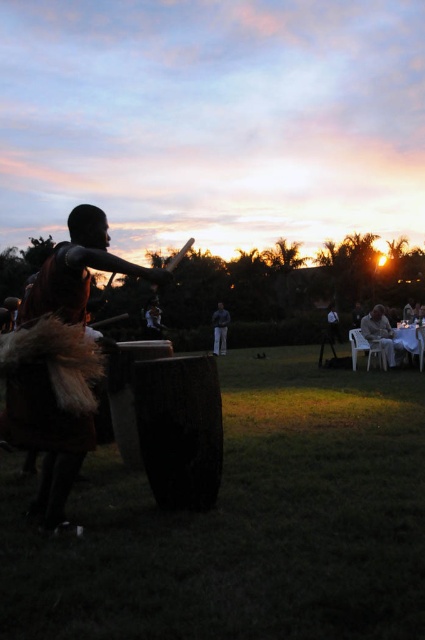
Is brown fur vest at left below white plastic chair at right?

No, brown fur vest at left is not below white plastic chair at right.

Does point (53, 456) come closer to viewer compared to point (374, 307)?

Yes, it is.

Identify the location of brown fur vest at left. The image size is (425, 640). (48, 442).

Does white plastic chair at right have a smaller size compared to dark gray fabric pants at center?

No, white plastic chair at right is not smaller than dark gray fabric pants at center.

Who is lower down, white plastic chair at right or dark gray fabric pants at center?

dark gray fabric pants at center

What do you see at coordinates (382, 333) in the screenshot? I see `white plastic chair at right` at bounding box center [382, 333].

You are a GUI agent. You are given a task and a screenshot of the screen. Output one action in this format:
    pyautogui.click(x=<x>, y=<y>)
    Task: Click on the white plastic chair at right
    
    Given the screenshot: What is the action you would take?
    pyautogui.click(x=382, y=333)

Is brown fur vest at left shorter than dark gray fabric pants at center?

Correct, brown fur vest at left is not as tall as dark gray fabric pants at center.

In order to click on brown fur vest at left in this screenshot , I will do `click(48, 442)`.

I want to click on brown fur vest at left, so click(48, 442).